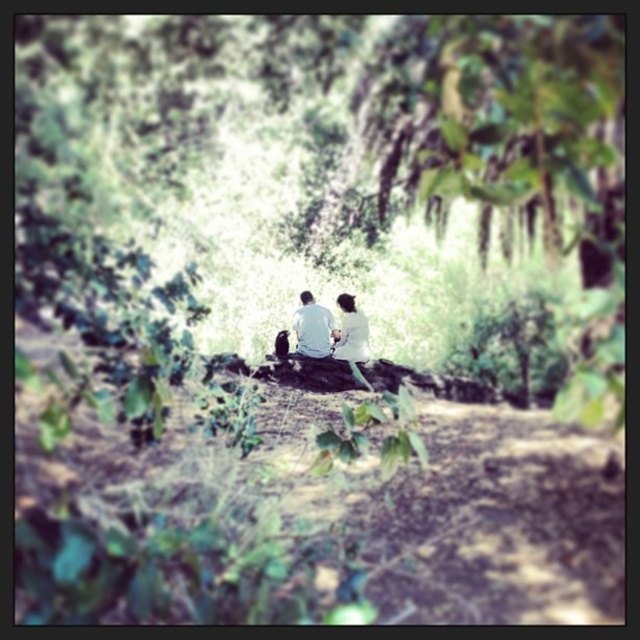
Which is behind, point (346, 320) or point (342, 337)?

The point (346, 320) is more distant.

Does white cotton shirt at center have a smaller size compared to white matte shirt at center?

Incorrect, white cotton shirt at center is not smaller in size than white matte shirt at center.

At what (x,y) coordinates should I click in order to perform the action: click on white cotton shirt at center. Please return your answer as a coordinate pair (x, y). Looking at the image, I should click on (332, 330).